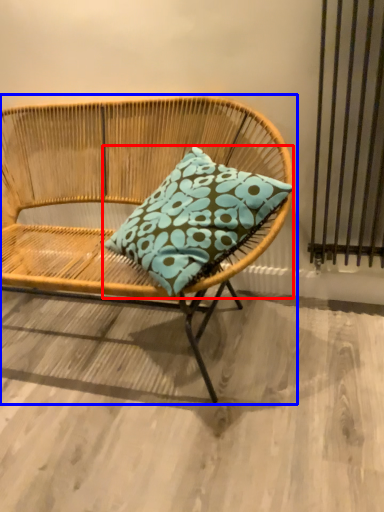
Question: Among these objects, which one is nearest to the camera, pillow (highlighted by a red box) or chair (highlighted by a blue box)?

Choices:
 (A) pillow
 (B) chair

Answer: (B)